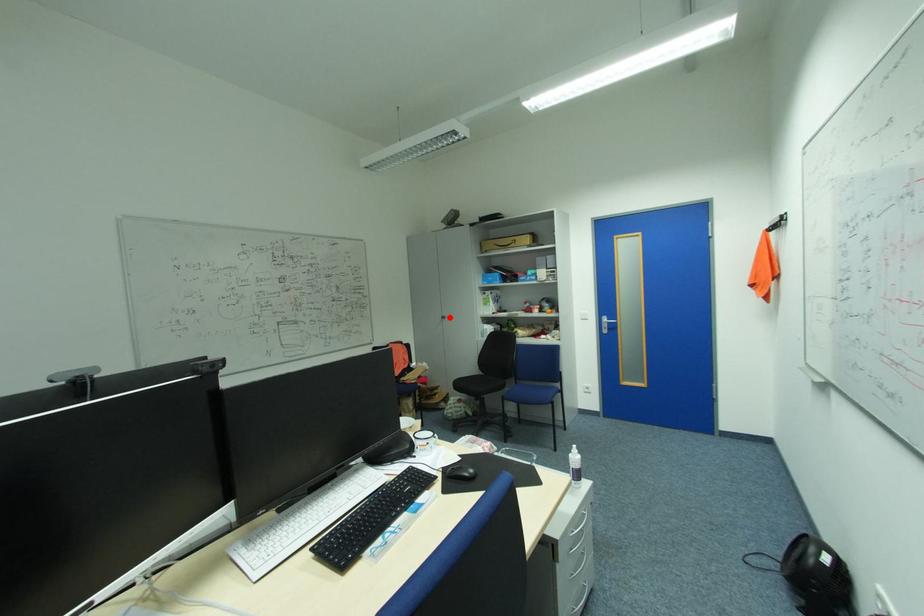
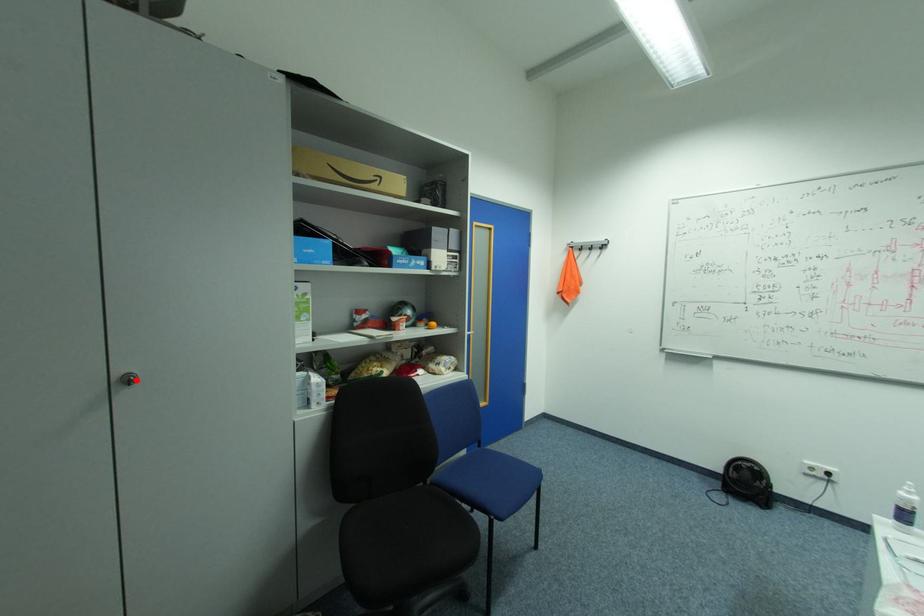
I am providing you with two images of the same scene from different viewpoints. A red point is marked on the first image and another point is marked on the second image. Does the point marked in image1 correspond to the same location as the one in image2?

Yes